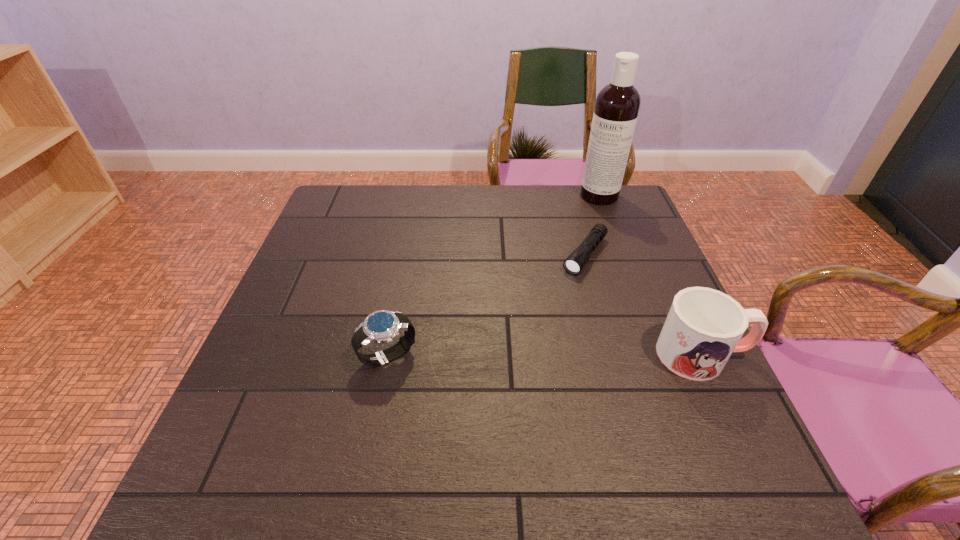
The image size is (960, 540). I want to click on vacant space at the near edge of the desktop, so (x=417, y=410).

Find the location of a particular element. The width and height of the screenshot is (960, 540). free space at the left edge of the desktop is located at coordinates (335, 314).

Locate an element on the screen. Image resolution: width=960 pixels, height=540 pixels. free space at the far right corner of the desktop is located at coordinates (628, 192).

The width and height of the screenshot is (960, 540). In the image, there is a desktop. What are the coordinates of `vacant space at the near right corner` in the screenshot? It's located at (706, 402).

Image resolution: width=960 pixels, height=540 pixels. Identify the location of vacant point located between the leftmost object and the shortest object. click(487, 306).

Find the location of a particular element. The width and height of the screenshot is (960, 540). free space between the third tallest object and the dishwasher detergent is located at coordinates (493, 276).

The height and width of the screenshot is (540, 960). I want to click on free space that is in between the third tallest object and the farthest object, so click(x=493, y=276).

Find the location of a particular element. free spot between the tallest object and the leftmost object is located at coordinates (493, 276).

Find the location of `free spot between the leftmost object and the second tallest object`. free spot between the leftmost object and the second tallest object is located at coordinates (545, 355).

At what (x,y) coordinates should I click in order to perform the action: click on free spot between the shortest object and the watch. Please return your answer as a coordinate pair (x, y). Looking at the image, I should click on click(x=487, y=306).